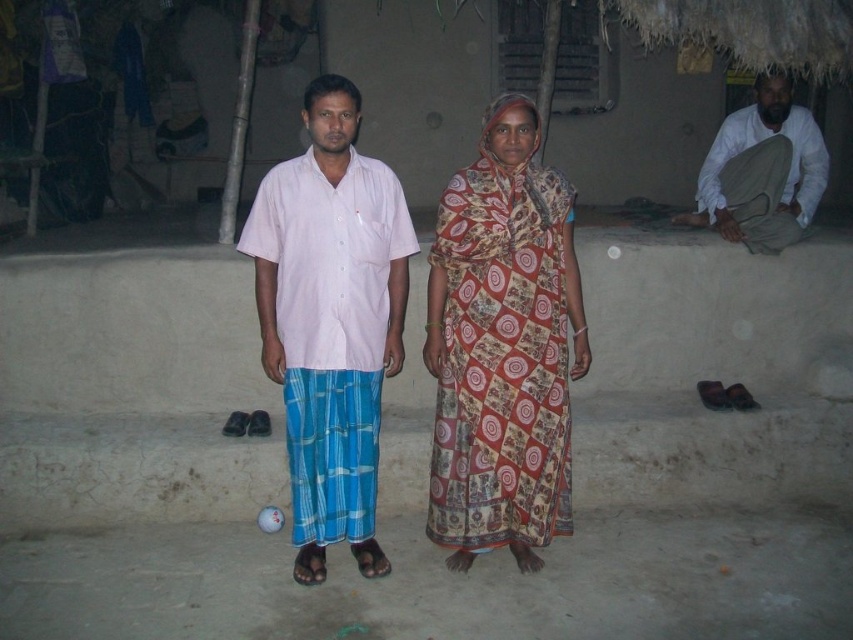
Does light pink cotton shirt at center appear on the left side of white cotton shirt at right?

Indeed, light pink cotton shirt at center is positioned on the left side of white cotton shirt at right.

Find the location of a particular element. The width and height of the screenshot is (853, 640). light pink cotton shirt at center is located at coordinates (331, 321).

Is point (428, 324) more distant than point (763, 154)?

No, (428, 324) is closer to viewer.

Which is behind, point (502, 515) or point (685, 221)?

Point (685, 221)

Is point (569, 186) closer to camera compared to point (717, 136)?

Yes, point (569, 186) is closer to viewer.

You are a GUI agent. You are given a task and a screenshot of the screen. Output one action in this format:
    pyautogui.click(x=<x>, y=<y>)
    Task: Click on the printed cotton sari at center
    The width and height of the screenshot is (853, 640).
    Given the screenshot: What is the action you would take?
    pyautogui.click(x=502, y=348)

Who is lower down, printed cotton sari at center or light pink cotton shirt at center?

printed cotton sari at center is below.

Who is higher up, printed cotton sari at center or light pink cotton shirt at center?

light pink cotton shirt at center

Is point (523, 305) farther from camera compared to point (300, 284)?

Yes.

Locate an element on the screen. printed cotton sari at center is located at coordinates (502, 348).